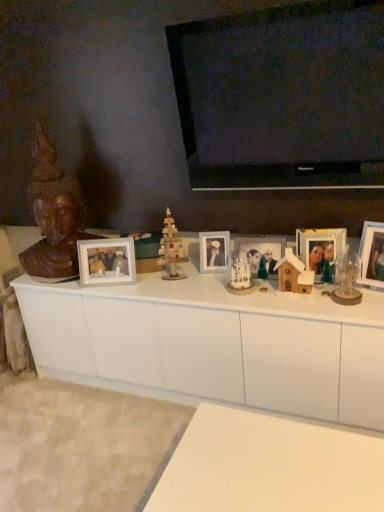
Find the location of a particular element. This screenshot has width=384, height=512. white matte picture frame at center, marked as the fifth picture frame in a right-to-left arrangement is located at coordinates (106, 261).

This screenshot has width=384, height=512. What do you see at coordinates (53, 216) in the screenshot? I see `wooden statue at left` at bounding box center [53, 216].

This screenshot has height=512, width=384. Describe the element at coordinates (214, 344) in the screenshot. I see `white matte cabinet at center` at that location.

What do you see at coordinates (372, 254) in the screenshot? I see `wooden photo frame at right, the 1th picture frame when ordered from right to left` at bounding box center [372, 254].

What is the approximate height of matte wooden picture frame at center, acting as the third picture frame starting from the right?

9.28 inches.

Locate an element on the screen. This screenshot has width=384, height=512. wooden christmas tree at center, which is counted as the third toy, starting from the right is located at coordinates (170, 249).

In order to click on white matte picture frame at center, marked as the fifth picture frame in a right-to-left arrangement in this screenshot , I will do `click(106, 261)`.

Does wooden christmas tree at center, arranged as the first toy when viewed from the left, contain white matte table at lower center?

Actually, white matte table at lower center is outside wooden christmas tree at center, arranged as the first toy when viewed from the left.

Is there a large distance between wooden christmas tree at center, which is counted as the third toy, starting from the right, and white matte table at lower center?

wooden christmas tree at center, which is counted as the third toy, starting from the right, is near white matte table at lower center, not far away.

Which object is wider, wooden christmas tree at center, which is counted as the third toy, starting from the right, or white matte table at lower center?

Wider between the two is white matte table at lower center.

Which toy is the 2nd one when counting from the left side of the white matte table at lower center? Please provide its 2D coordinates.

[(170, 249)]

Which is more distant, (224, 245) or (161, 246)?

Positioned behind is point (161, 246).

Is matte glass photo frame at center, the 4th picture frame from the right, oriented towards wooden christmas tree at center, which is counted as the third toy, starting from the right?

No, matte glass photo frame at center, the 4th picture frame from the right, is not aimed at wooden christmas tree at center, which is counted as the third toy, starting from the right.

From the image's perspective, is matte glass photo frame at center, positioned as the 2th picture frame in left-to-right order, located beneath wooden christmas tree at center, arranged as the first toy when viewed from the left?

Yes, from the image's perspective, matte glass photo frame at center, positioned as the 2th picture frame in left-to-right order, is beneath wooden christmas tree at center, arranged as the first toy when viewed from the left.

Considering the relative sizes of white matte table at lower center and matte wooden picture frame at center, which ranks as the 3th picture frame in left-to-right order, in the image provided, is white matte table at lower center thinner than matte wooden picture frame at center, which ranks as the 3th picture frame in left-to-right order,?

In fact, white matte table at lower center might be wider than matte wooden picture frame at center, which ranks as the 3th picture frame in left-to-right order.

Image resolution: width=384 pixels, height=512 pixels. Find the location of `table below the matte wooden picture frame at center, which ranks as the 3th picture frame in left-to-right order (from the image's perspective)`. table below the matte wooden picture frame at center, which ranks as the 3th picture frame in left-to-right order (from the image's perspective) is located at coordinates (269, 466).

From a real-world perspective, is white matte table at lower center above or below matte wooden picture frame at center, acting as the third picture frame starting from the right?

white matte table at lower center is situated lower than matte wooden picture frame at center, acting as the third picture frame starting from the right, in the real world.

Is white ceramic snowman at center, which is the 2th toy in left-to-right order, in front of white matte cabinet at center?

No.

From a real-world perspective, is white ceramic snowman at center, which is the 2th toy in left-to-right order, located higher than white matte cabinet at center?

Indeed, from a real-world perspective, white ceramic snowman at center, which is the 2th toy in left-to-right order, stands above white matte cabinet at center.

From the image's perspective, is white ceramic snowman at center, which is the 2th toy in left-to-right order, above or below white matte cabinet at center?

white ceramic snowman at center, which is the 2th toy in left-to-right order, is situated higher than white matte cabinet at center in the image.

Are matte wooden picture frame at center, which ranks as the 3th picture frame in left-to-right order, and wooden photo frame at right, the 1th picture frame when ordered from right to left, making contact?

No, matte wooden picture frame at center, which ranks as the 3th picture frame in left-to-right order, is not with wooden photo frame at right, the 1th picture frame when ordered from right to left.

Where is `the 3rd picture frame located beneath the wooden photo frame at right, the 1th picture frame when ordered from right to left (from a real-world perspective)`? the 3rd picture frame located beneath the wooden photo frame at right, the 1th picture frame when ordered from right to left (from a real-world perspective) is located at coordinates (260, 253).

From the image's perspective, which is above, matte wooden picture frame at center, which ranks as the 3th picture frame in left-to-right order, or wooden photo frame at right, arranged as the 5th picture frame when viewed from the left?

wooden photo frame at right, arranged as the 5th picture frame when viewed from the left, from the image's perspective.

From their relative heights in the image, would you say matte wooden picture frame at center, acting as the third picture frame starting from the right, is taller or shorter than wooden photo frame at right, arranged as the 5th picture frame when viewed from the left?

In the image, matte wooden picture frame at center, acting as the third picture frame starting from the right, appears to be shorter than wooden photo frame at right, arranged as the 5th picture frame when viewed from the left.

How many degrees apart are the facing directions of white matte cabinet at center and white matte picture frame at center, marked as the fifth picture frame in a right-to-left arrangement?

They differ by 18.1 degrees in their facing directions.

I want to click on cabinetry that appears below the white matte picture frame at center, marked as the fifth picture frame in a right-to-left arrangement (from a real-world perspective), so click(214, 344).

Can we say white matte cabinet at center lies outside white matte picture frame at center, marked as the fifth picture frame in a right-to-left arrangement?

Absolutely, white matte cabinet at center is external to white matte picture frame at center, marked as the fifth picture frame in a right-to-left arrangement.

From the picture: Is white matte cabinet at center facing away from white matte picture frame at center, placed as the 1th picture frame when sorted from left to right?

No, white matte picture frame at center, placed as the 1th picture frame when sorted from left to right, is not at the back of white matte cabinet at center.

Looking at this image, is white matte cabinet at center inside the boundaries of matte glass photo frame at center, positioned as the 2th picture frame in left-to-right order, or outside?

The correct answer is: outside.

From a real-world perspective, is white matte cabinet at center beneath matte glass photo frame at center, positioned as the 2th picture frame in left-to-right order?

Yes, from a real-world perspective, white matte cabinet at center is beneath matte glass photo frame at center, positioned as the 2th picture frame in left-to-right order.

Is white matte cabinet at center aimed at matte glass photo frame at center, positioned as the 2th picture frame in left-to-right order?

No.

Is white matte cabinet at center with matte glass photo frame at center, the 4th picture frame from the right?

No, white matte cabinet at center is not next to matte glass photo frame at center, the 4th picture frame from the right.

Identify the location of table on the right of the wooden christmas tree at center, which is counted as the third toy, starting from the right. The image size is (384, 512). (269, 466).

I want to click on toy above the matte glass photo frame at center, positioned as the 2th picture frame in left-to-right order (from the image's perspective), so click(170, 249).

From the image, which object appears to be nearer to wooden photo frame at right, arranged as the 5th picture frame when viewed from the left, matte glass photo frame at center, the 4th picture frame from the right, or matte glass photo frame at center right, which is the 2th picture frame from right to left?

matte glass photo frame at center right, which is the 2th picture frame from right to left, is closer to wooden photo frame at right, arranged as the 5th picture frame when viewed from the left.

From the image, which object appears to be nearer to matte glass photo frame at center, positioned as the 2th picture frame in left-to-right order, matte glass photo frame at center right, which is the 2th picture frame from right to left, or matte wooden picture frame at center, which ranks as the 3th picture frame in left-to-right order?

matte wooden picture frame at center, which ranks as the 3th picture frame in left-to-right order.

From the picture: Based on their spatial positions, is matte glass photo frame at center right, which is the 2th picture frame from right to left, or wooden photo frame at right, arranged as the 5th picture frame when viewed from the left, further from wooden statue at left?

wooden photo frame at right, arranged as the 5th picture frame when viewed from the left.

Considering their positions, is wooden photo frame at right, arranged as the 5th picture frame when viewed from the left, positioned closer to white matte table at lower center than matte glass photo frame at center, the 4th picture frame from the right?

wooden photo frame at right, arranged as the 5th picture frame when viewed from the left, is closer to white matte table at lower center.

Based on their spatial positions, is matte wooden picture frame at center, acting as the third picture frame starting from the right, or white matte table at lower center further from white ceramic snowman at center, the 2th toy from the right?

white matte table at lower center.

Based on their spatial positions, is white ceramic snowman at center, the 2th toy from the right, or wooden christmas tree at center, which is counted as the third toy, starting from the right, further from matte wooden picture frame at center, which ranks as the 3th picture frame in left-to-right order?

wooden christmas tree at center, which is counted as the third toy, starting from the right, is positioned further to the anchor matte wooden picture frame at center, which ranks as the 3th picture frame in left-to-right order.

From the image, which object appears to be farther from white matte cabinet at center, matte wooden picture frame at center, which ranks as the 3th picture frame in left-to-right order, or matte glass photo frame at center, positioned as the 2th picture frame in left-to-right order?

Based on the image, matte glass photo frame at center, positioned as the 2th picture frame in left-to-right order, appears to be further to white matte cabinet at center.

Considering their positions, is white wooden house at center, which is the first toy from right to left, positioned closer to matte glass photo frame at center right, which is the 2th picture frame from right to left, than wooden christmas tree at center, arranged as the first toy when viewed from the left?

white wooden house at center, which is the first toy from right to left.

This screenshot has height=512, width=384. I want to click on cabinetry between matte glass photo frame at center right, the 4th picture frame viewed from the left, and white matte table at lower center from top to bottom, so tap(214, 344).

I want to click on picture frame between matte glass photo frame at center, positioned as the 2th picture frame in left-to-right order, and matte glass photo frame at center right, which is the 2th picture frame from right to left, from left to right, so click(x=260, y=253).

The height and width of the screenshot is (512, 384). I want to click on cabinetry between white matte table at lower center and matte glass photo frame at center, the 4th picture frame from the right, along the z-axis, so click(214, 344).

At what (x,y) coordinates should I click in order to perform the action: click on table located between wooden statue at left and wooden photo frame at right, arranged as the 5th picture frame when viewed from the left, in the left-right direction. Please return your answer as a coordinate pair (x, y). The image size is (384, 512). Looking at the image, I should click on (269, 466).